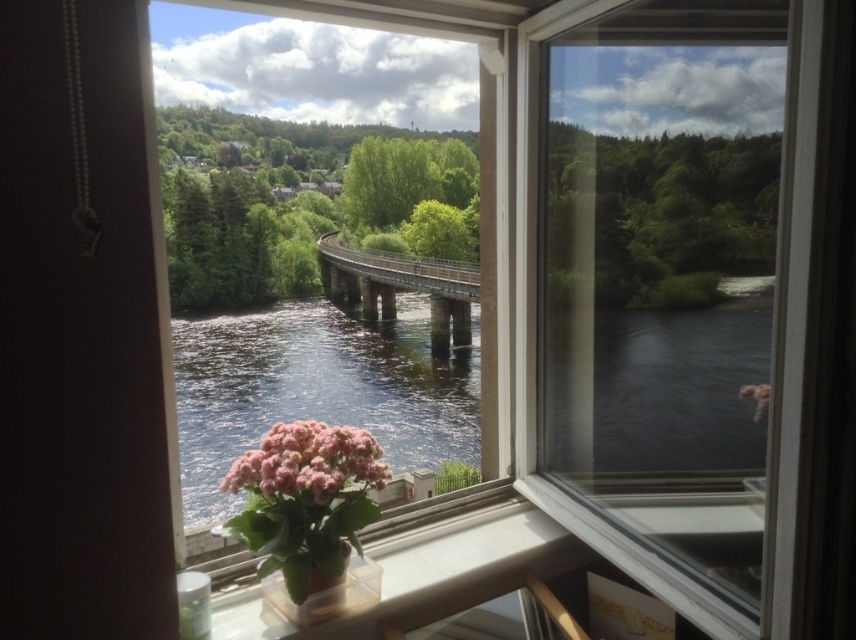
Question: Estimate the real-world distances between objects in this image. Which object is farther from the clear plastic container at lower center?

Choices:
 (A) pink matte flower at lower center
 (B) green matte vase at lower center

Answer: (A)

Question: Which point is closer to the camera?

Choices:
 (A) (352, 573)
 (B) (479, 577)
 (C) (694, 417)

Answer: (C)

Question: Which point is closer to the camera?

Choices:
 (A) (434, 330)
 (B) (388, 332)

Answer: (A)

Question: Can you confirm if clear plastic container at lower center is positioned to the left of metal bridge at center?

Choices:
 (A) yes
 (B) no

Answer: (B)

Question: Does dark reflective water at center have a smaller size compared to pink matte flower at lower center?

Choices:
 (A) no
 (B) yes

Answer: (A)

Question: Is clear plastic container at lower center below metal bridge at center?

Choices:
 (A) yes
 (B) no

Answer: (A)